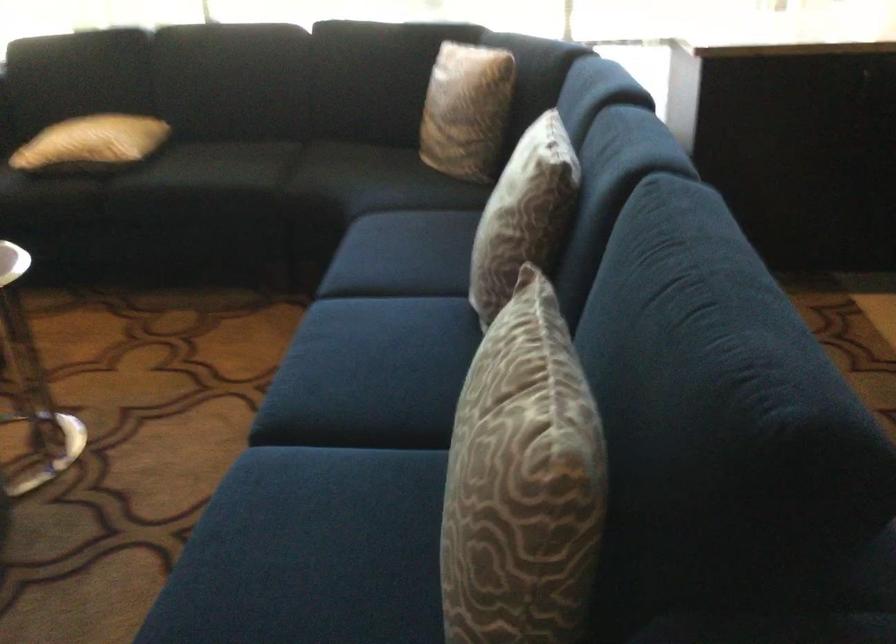
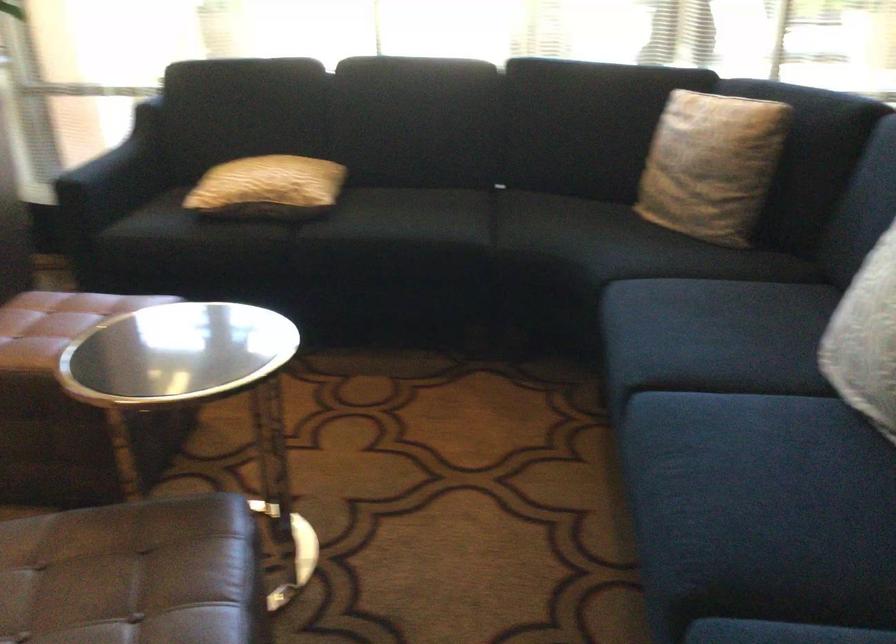
The point at (477, 251) is marked in the first image. Where is the corresponding point in the second image?

(866, 339)